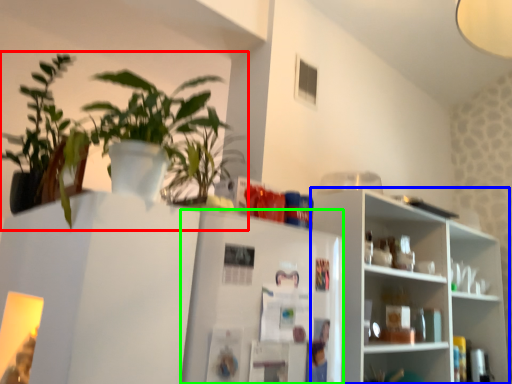
Question: Which object is the closest to the houseplant (highlighted by a red box)? Choose among these: shelf (highlighted by a blue box) or fridge (highlighted by a green box).

Choices:
 (A) shelf
 (B) fridge

Answer: (B)